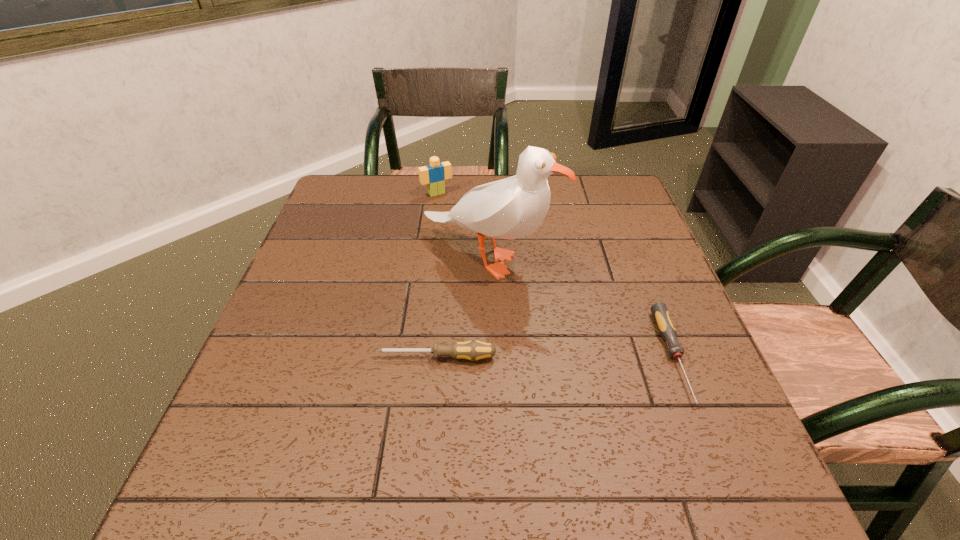
This screenshot has width=960, height=540. What are the coordinates of `the third tallest object` in the screenshot? It's located at (473, 350).

The height and width of the screenshot is (540, 960). Identify the location of the taller screwdriver. (473, 350).

Locate an element on the screen. The width and height of the screenshot is (960, 540). the shortest object is located at coordinates [x=665, y=325].

Where is `the rightmost object`? This screenshot has width=960, height=540. the rightmost object is located at coordinates (665, 325).

I want to click on the farthest object, so click(435, 174).

Identify the location of the third shortest object. Image resolution: width=960 pixels, height=540 pixels. (435, 174).

Identify the location of the third nearest object. The image size is (960, 540). (514, 207).

Identify the location of gull. The height and width of the screenshot is (540, 960). (514, 207).

Find the location of a particular element. Image resolution: width=960 pixels, height=540 pixels. vacant area located 0.080m at the tip of the second shortest object is located at coordinates (338, 357).

Find the location of `vacant space located 0.250m at the tip of the second shortest object`. vacant space located 0.250m at the tip of the second shortest object is located at coordinates (254, 357).